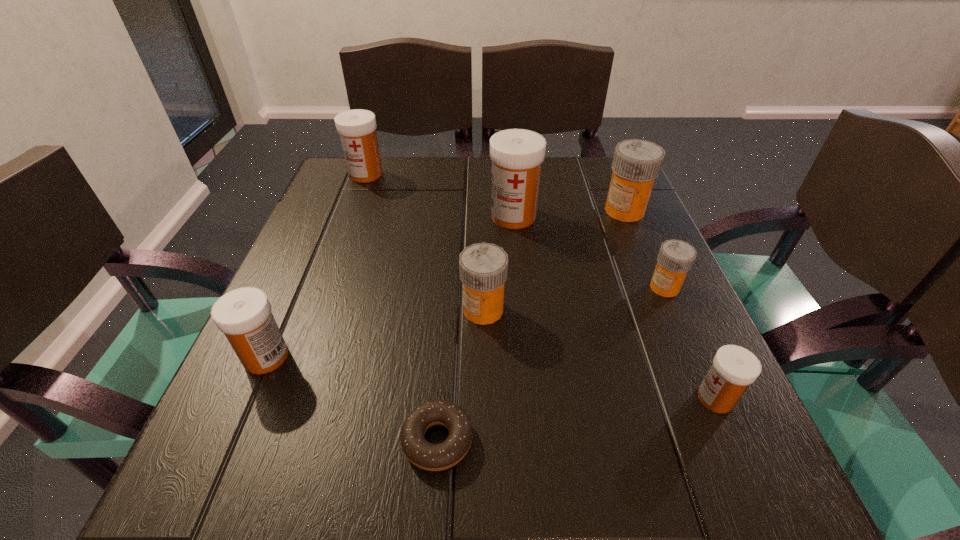
This screenshot has height=540, width=960. I want to click on orange medicine that is the closest to the brown doughnut, so click(x=483, y=267).

This screenshot has height=540, width=960. What are the coordinates of `free point that satisfies the following two spatial constraints: 1. on the front side of the brown doughnut; 2. on the left side of the second nearest medicine` in the screenshot? It's located at (229, 440).

At what (x,y) coordinates should I click in order to perform the action: click on vacant point that satisfies the following two spatial constraints: 1. on the back side of the smallest white medicine; 2. on the label side of the smallest orange medicine. Please return your answer as a coordinate pair (x, y). Looking at the image, I should click on (666, 287).